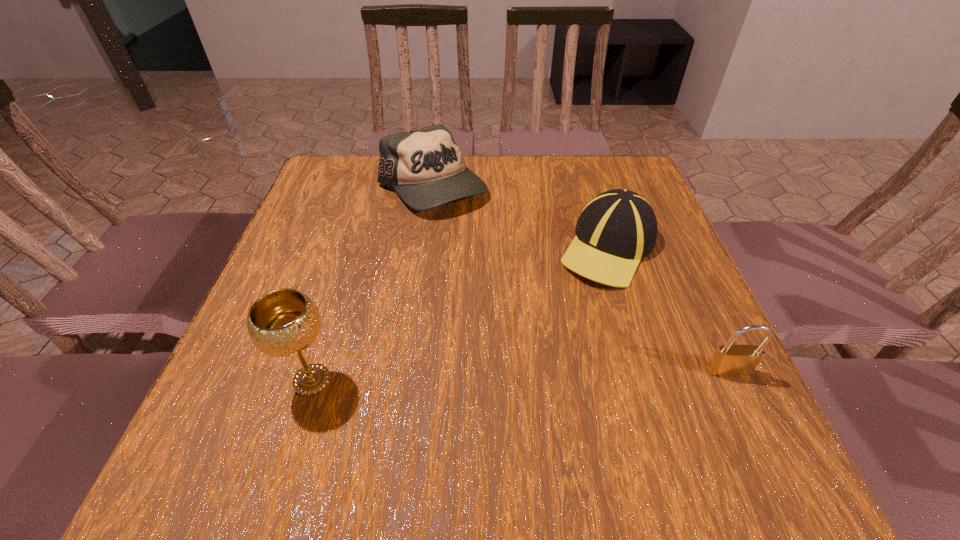
Where is `free space between the right baseball cap and the tallest object`? The image size is (960, 540). free space between the right baseball cap and the tallest object is located at coordinates (460, 314).

The image size is (960, 540). I want to click on free space that is in between the tallest object and the padlock, so click(x=520, y=375).

The width and height of the screenshot is (960, 540). What are the coordinates of `vacant area between the right baseball cap and the left baseball cap` in the screenshot? It's located at (520, 218).

This screenshot has height=540, width=960. In order to click on free space between the chalice and the right baseball cap in this screenshot , I will do `click(460, 314)`.

Where is `vacant point located between the right baseball cap and the left baseball cap`? This screenshot has height=540, width=960. vacant point located between the right baseball cap and the left baseball cap is located at coordinates (520, 218).

Where is `free space that is in between the chalice and the left baseball cap`? The width and height of the screenshot is (960, 540). free space that is in between the chalice and the left baseball cap is located at coordinates (372, 284).

Locate an element on the screen. free spot between the left baseball cap and the right baseball cap is located at coordinates (520, 218).

You are a GUI agent. You are given a task and a screenshot of the screen. Output one action in this format:
    pyautogui.click(x=<x>, y=<y>)
    Task: Click on the second closest object to the right baseball cap
    This screenshot has height=540, width=960.
    Given the screenshot: What is the action you would take?
    pyautogui.click(x=728, y=360)

Point out which object is positioned as the second nearest to the chalice. Please provide its 2D coordinates. Your answer should be formatted as a tuple, i.e. [(x, y)], where the tuple contains the x and y coordinates of a point satisfying the conditions above.

[(616, 229)]